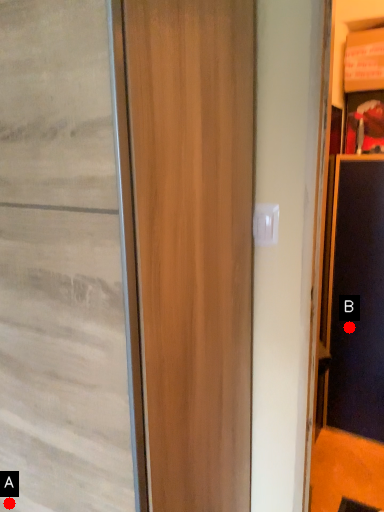
Question: Two points are circled on the image, labeled by A and B beside each circle. Which point is farther from the camera taking this photo?

Choices:
 (A) A is further
 (B) B is further

Answer: (B)